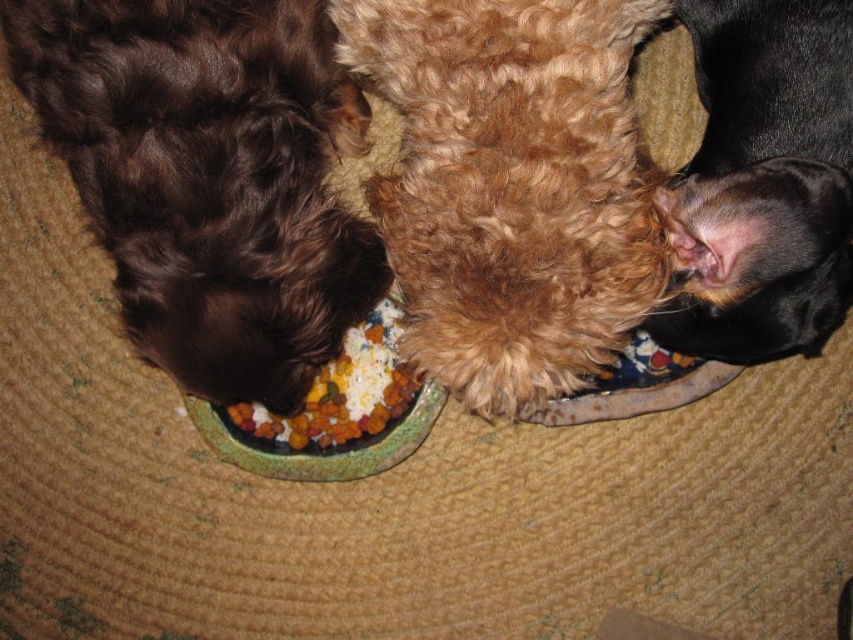
Based on the photo, you are a dog owner who wants to place a new toy between the shiny brown fur at left and the black fur at upper right. Based on their heights, which dog should you consider placing the toy closer to?

The shiny brown fur at left has a greater height compared to the black fur at upper right, so the toy should be placed closer to the shiny brown fur at left to ensure it is accessible to both dogs.

You are a dog owner who wants to place a new toy between the shiny brown fur at left and the black fur at upper right. Based on their positions, which dog is closer to the center of the carpet?

The shiny brown fur at left is positioned over black fur at upper right, so the shiny brown fur at left is closer to the center of the carpet than the black fur at upper right.